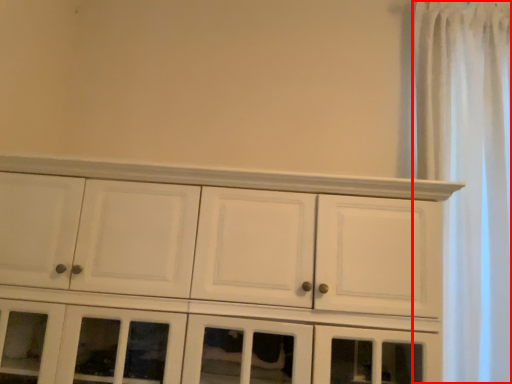
Question: From the image, what is the correct spatial relationship of shower curtain (annotated by the red box) in relation to cupboard?

Choices:
 (A) right
 (B) left

Answer: (A)